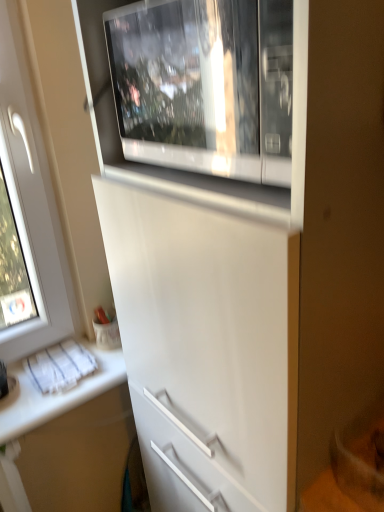
The image size is (384, 512). What do you see at coordinates (203, 85) in the screenshot? I see `white glossy microwave at upper center` at bounding box center [203, 85].

Where is `white glossy microwave at upper center`? The width and height of the screenshot is (384, 512). white glossy microwave at upper center is located at coordinates (203, 85).

I want to click on white glossy countertop at lower left, so click(x=56, y=394).

This screenshot has width=384, height=512. What do you see at coordinates (56, 394) in the screenshot?
I see `white glossy countertop at lower left` at bounding box center [56, 394].

Find the location of a particular element. The image size is (384, 512). white glossy microwave at upper center is located at coordinates (203, 85).

Can you confirm if white glossy microwave at upper center is positioned to the left of white glossy countertop at lower left?

Incorrect, white glossy microwave at upper center is not on the left side of white glossy countertop at lower left.

Which object is further away from the camera, white glossy microwave at upper center or white glossy countertop at lower left?

white glossy countertop at lower left.

Considering the positions of points (212, 31) and (92, 397), is point (212, 31) farther from camera compared to point (92, 397)?

No, it is in front of (92, 397).

From the image's perspective, which is below, white glossy microwave at upper center or white glossy countertop at lower left?

white glossy countertop at lower left appears lower in the image.

From a real-world perspective, which is physically above, white glossy microwave at upper center or white glossy countertop at lower left?

white glossy microwave at upper center.

Is white glossy microwave at upper center wider than white glossy countertop at lower left?

In fact, white glossy microwave at upper center might be narrower than white glossy countertop at lower left.

Who is shorter, white glossy microwave at upper center or white glossy countertop at lower left?

white glossy countertop at lower left.

In terms of size, does white glossy microwave at upper center appear bigger or smaller than white glossy countertop at lower left?

white glossy microwave at upper center is bigger than white glossy countertop at lower left.

Is white glossy microwave at upper center outside of white glossy countertop at lower left?

Absolutely, white glossy microwave at upper center is external to white glossy countertop at lower left.

Is there a large distance between white glossy microwave at upper center and white glossy countertop at lower left?

white glossy microwave at upper center is near white glossy countertop at lower left, not far away.

In the scene shown: Is white glossy microwave at upper center facing towards white glossy countertop at lower left?

No, white glossy microwave at upper center is not facing towards white glossy countertop at lower left.

How different are the orientations of white glossy microwave at upper center and white glossy countertop at lower left in degrees?

The angle between the facing direction of white glossy microwave at upper center and the facing direction of white glossy countertop at lower left is 88 degrees.

What are the coordinates of `home appliance that appears on the right of white glossy countertop at lower left` in the screenshot? It's located at (203, 85).

Considering the positions of objects white glossy countertop at lower left and white glossy microwave at upper center in the image provided, who is more to the left, white glossy countertop at lower left or white glossy microwave at upper center?

From the viewer's perspective, white glossy countertop at lower left appears more on the left side.

Does white glossy countertop at lower left come behind white glossy microwave at upper center?

That is True.

Is point (3, 441) behind point (276, 127)?

Yes, point (3, 441) is behind point (276, 127).

From the image's perspective, which one is positioned lower, white glossy countertop at lower left or white glossy microwave at upper center?

white glossy countertop at lower left, from the image's perspective.

From a real-world perspective, who is located lower, white glossy countertop at lower left or white glossy microwave at upper center?

white glossy countertop at lower left is physically lower.

Considering the sizes of objects white glossy countertop at lower left and white glossy microwave at upper center in the image provided, who is wider, white glossy countertop at lower left or white glossy microwave at upper center?

With larger width is white glossy countertop at lower left.

Considering the relative sizes of white glossy countertop at lower left and white glossy microwave at upper center in the image provided, is white glossy countertop at lower left taller than white glossy microwave at upper center?

No, white glossy countertop at lower left is not taller than white glossy microwave at upper center.

Considering the sizes of objects white glossy countertop at lower left and white glossy microwave at upper center in the image provided, who is smaller, white glossy countertop at lower left or white glossy microwave at upper center?

Smaller between the two is white glossy countertop at lower left.

Looking at this image, is white glossy countertop at lower left positioned beyond the bounds of white glossy microwave at upper center?

Absolutely, white glossy countertop at lower left is external to white glossy microwave at upper center.

Is there a large distance between white glossy countertop at lower left and white glossy microwave at upper center?

No, white glossy countertop at lower left is not far away from white glossy microwave at upper center.

Is white glossy countertop at lower left positioned with its back to white glossy microwave at upper center?

No, white glossy countertop at lower left's orientation is not away from white glossy microwave at upper center.

What's the angular difference between white glossy countertop at lower left and white glossy microwave at upper center's facing directions?

white glossy countertop at lower left and white glossy microwave at upper center are facing 88 degrees away from each other.

You are a GUI agent. You are given a task and a screenshot of the screen. Output one action in this format:
    pyautogui.click(x=<x>, y=<y>)
    Task: Click on the home appliance located above the white glossy countertop at lower left (from the image's perspective)
    The width and height of the screenshot is (384, 512).
    Given the screenshot: What is the action you would take?
    [x=203, y=85]

The image size is (384, 512). Find the location of `home appliance that appears in front of the white glossy countertop at lower left`. home appliance that appears in front of the white glossy countertop at lower left is located at coordinates (203, 85).

The width and height of the screenshot is (384, 512). What are the coordinates of `home appliance above the white glossy countertop at lower left (from a real-world perspective)` in the screenshot? It's located at (203, 85).